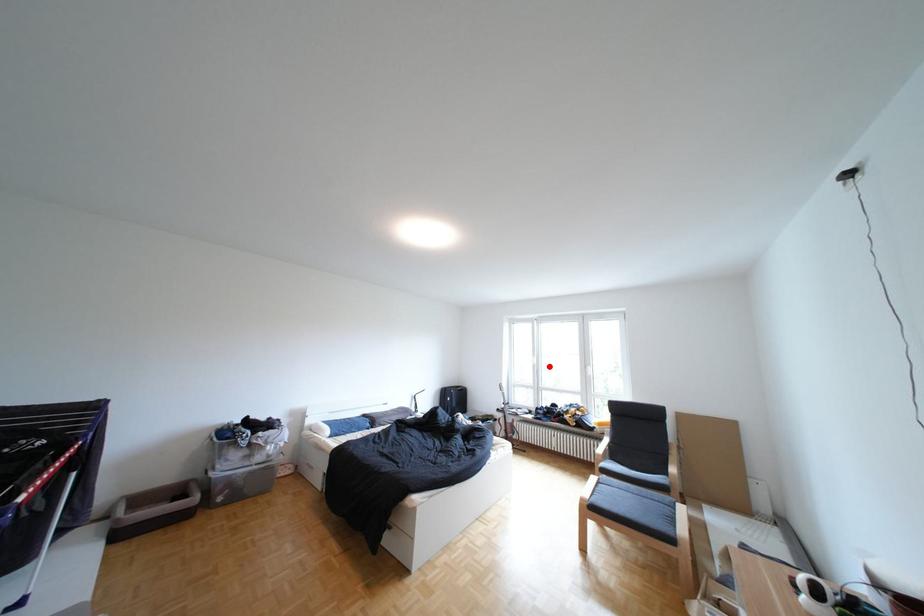
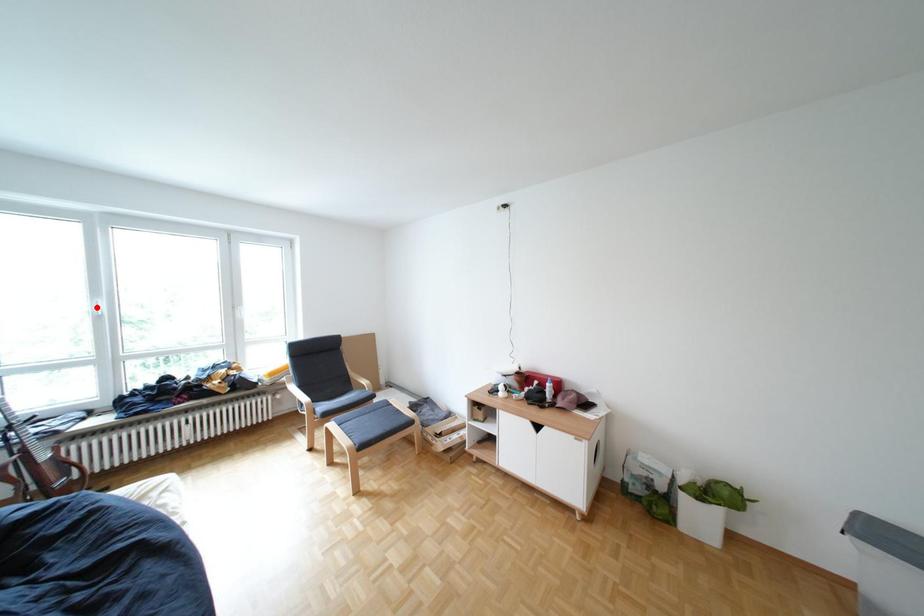
I am providing you with two images of the same scene from different viewpoints. A red point is marked on the first image and another point is marked on the second image. Does the point marked in image1 correspond to the same location as the one in image2?

No